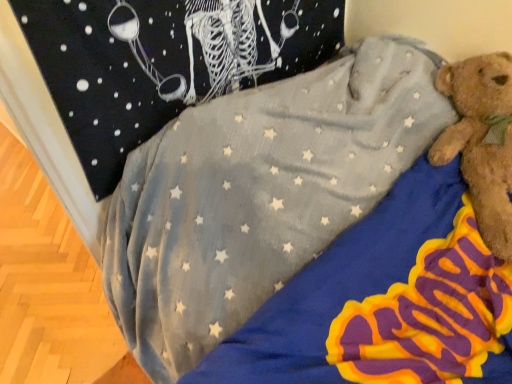
Measure the distance between point (x=206, y=314) and camera.

Point (x=206, y=314) and camera are 86.70 centimeters apart.

Where is `gray star-patterned blanket at upper center`? gray star-patterned blanket at upper center is located at coordinates (258, 194).

Describe the element at coordinates (258, 194) in the screenshot. I see `gray star-patterned blanket at upper center` at that location.

Image resolution: width=512 pixels, height=384 pixels. I want to click on gray star-patterned blanket at upper center, so click(x=258, y=194).